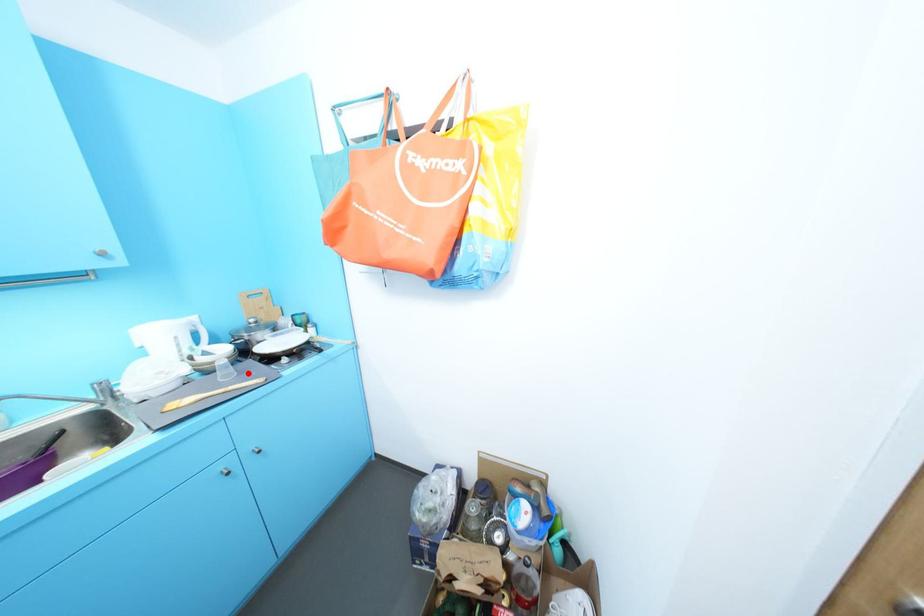
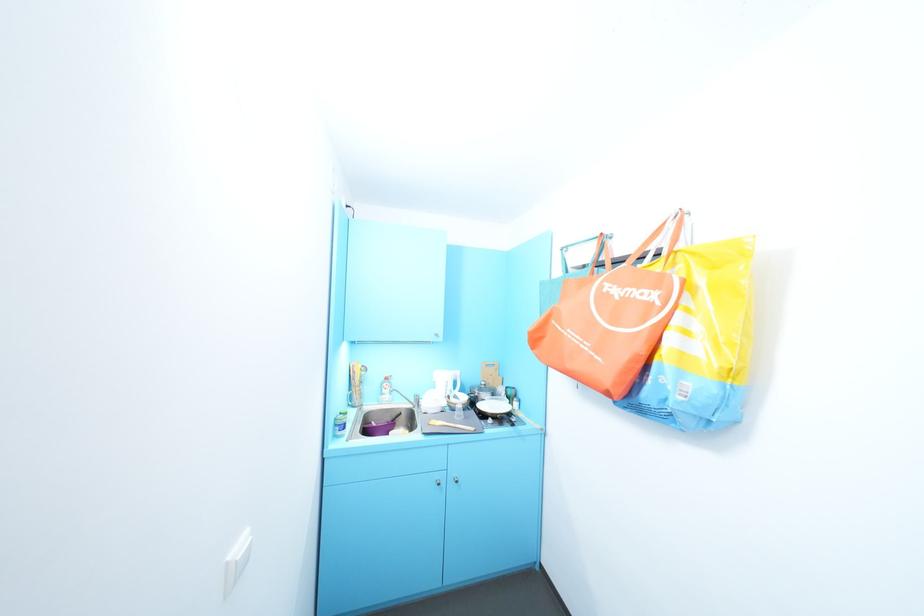
Locate, in the second image, the point that corresponds to the highlighted location in the first image.

(472, 418)